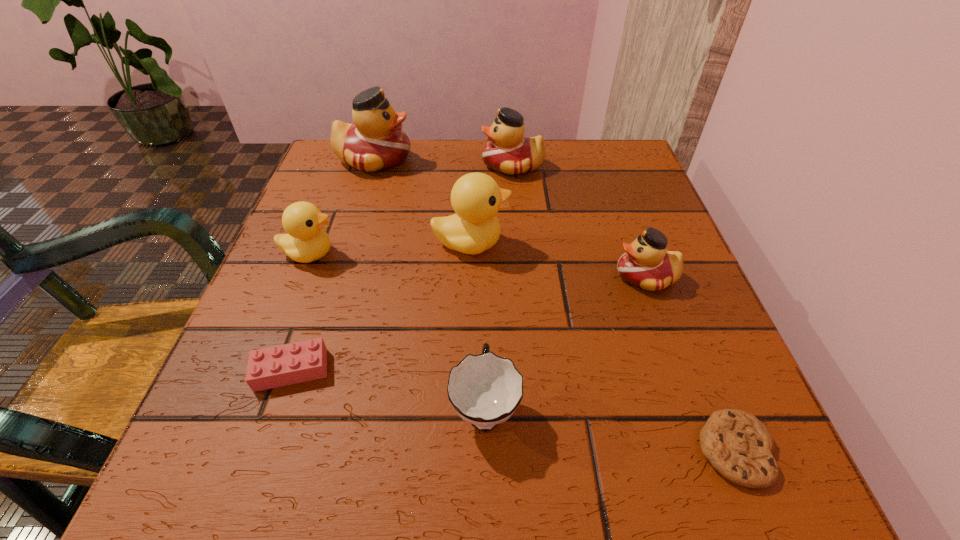
The width and height of the screenshot is (960, 540). Find the location of `the shortest object`. the shortest object is located at coordinates (737, 444).

The height and width of the screenshot is (540, 960). In order to click on cookie in this screenshot , I will do `click(737, 444)`.

This screenshot has height=540, width=960. What are the coordinates of `vacant space situated 0.370m on the face of the biggest red duck` in the screenshot? It's located at (571, 159).

This screenshot has width=960, height=540. Find the location of `vacant region located on the face of the bigger yellow duck`. vacant region located on the face of the bigger yellow duck is located at coordinates (621, 243).

The image size is (960, 540). I want to click on vacant space situated 0.120m on the face of the second smallest red duck, so click(429, 166).

You are a GUI agent. You are given a task and a screenshot of the screen. Output one action in this format:
    pyautogui.click(x=<x>, y=<y>)
    Task: Click on the free space located 0.220m on the face of the second smallest red duck
    Image resolution: width=960 pixels, height=540 pixels.
    Given the screenshot: What is the action you would take?
    pyautogui.click(x=386, y=166)

Locate an element on the screen. The width and height of the screenshot is (960, 540). blank space located on the face of the second smallest red duck is located at coordinates coord(328,166).

Where is `free region located on the face of the smaller yellow duck`? This screenshot has height=540, width=960. free region located on the face of the smaller yellow duck is located at coordinates (547, 253).

At what (x,y) coordinates should I click in order to perform the action: click on free space located 0.120m on the face of the rightmost duck. Please return your answer as a coordinate pair (x, y). This screenshot has height=540, width=960. Looking at the image, I should click on (545, 276).

Where is `free space located 0.400m on the face of the rightmost duck`? The image size is (960, 540). free space located 0.400m on the face of the rightmost duck is located at coordinates (384, 276).